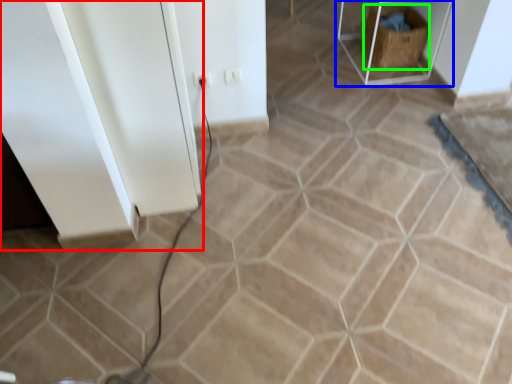
Question: Which is nearer to the cabinetry (highlighted by a red box)? furniture (highlighted by a blue box) or crate (highlighted by a green box).

Choices:
 (A) furniture
 (B) crate

Answer: (A)